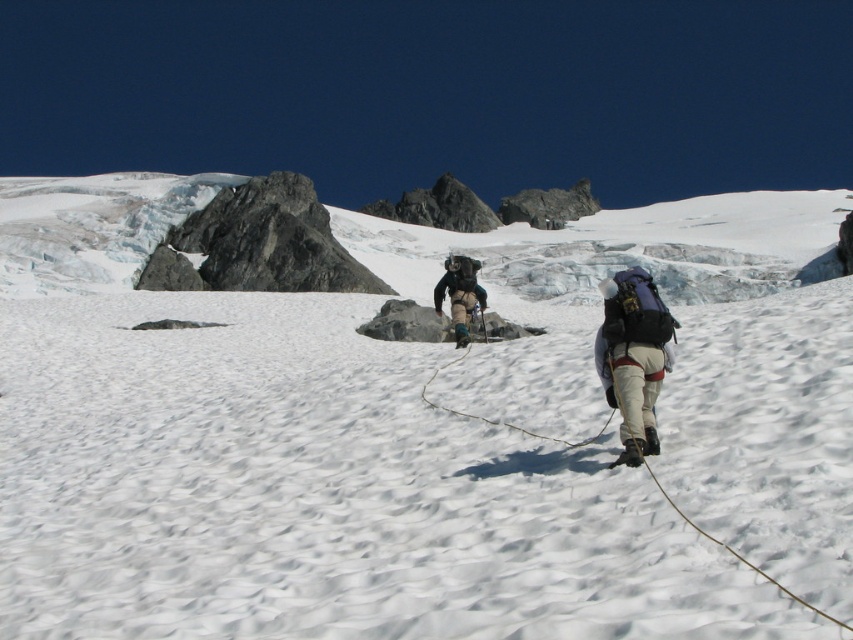
Question: Does matte blue backpack at right appear on the right side of brown rope at center?

Choices:
 (A) yes
 (B) no

Answer: (A)

Question: Which is farther from the brown rope at center?

Choices:
 (A) white powdery snow at center
 (B) dark gray fabric backpack at center
 (C) matte blue backpack at right

Answer: (A)

Question: Can you confirm if white powdery snow at center is positioned to the left of dark gray fabric backpack at center?

Choices:
 (A) yes
 (B) no

Answer: (A)

Question: Which point is farther to the camera?

Choices:
 (A) matte blue backpack at right
 (B) brown rope at center
 (C) white powdery snow at center

Answer: (A)

Question: Does matte blue backpack at right have a larger size compared to dark gray fabric backpack at center?

Choices:
 (A) no
 (B) yes

Answer: (A)

Question: Which of the following is the closest to the observer?

Choices:
 (A) dark gray fabric backpack at center
 (B) white powdery snow at center

Answer: (B)